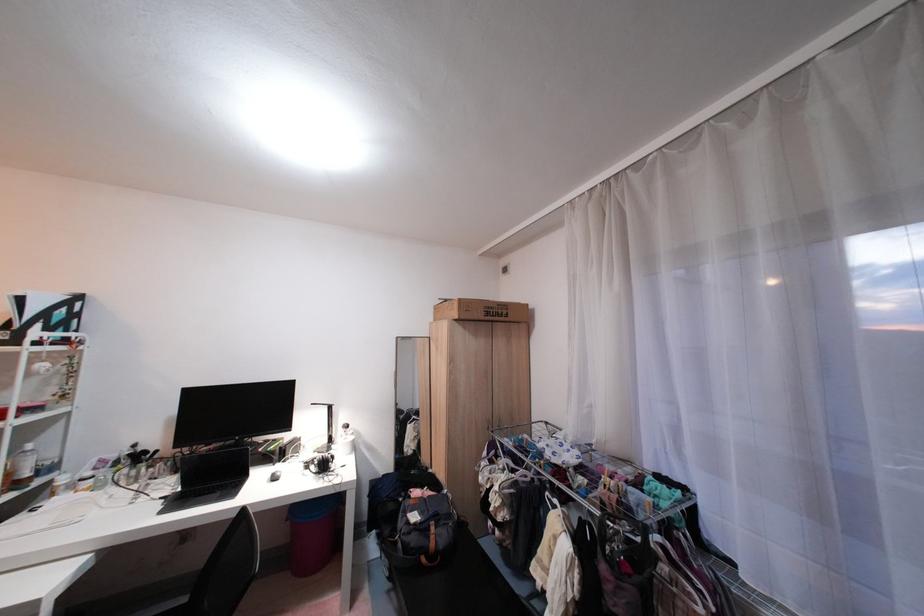
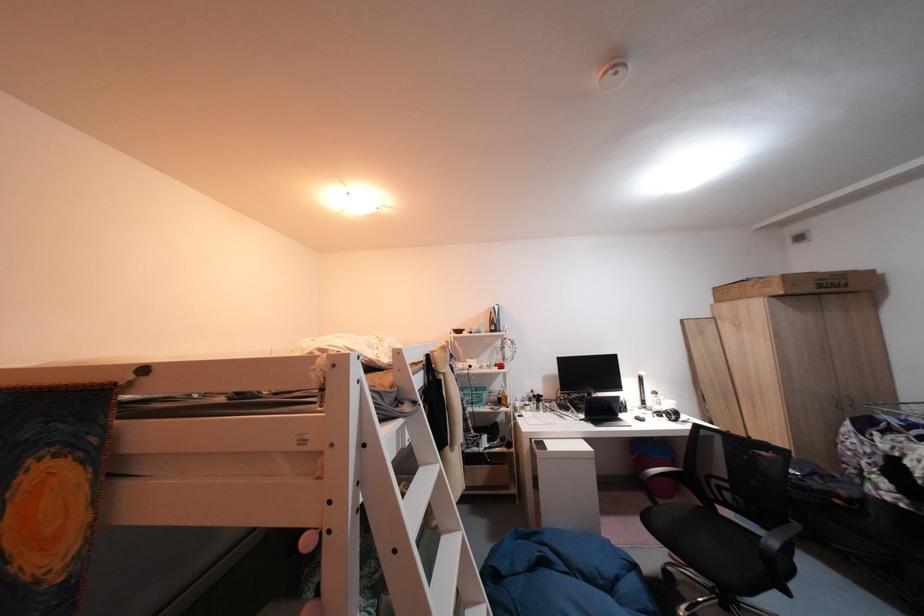
Which direction would the cameraman need to move to produce the second image?

The cameraman walked toward left, backward.